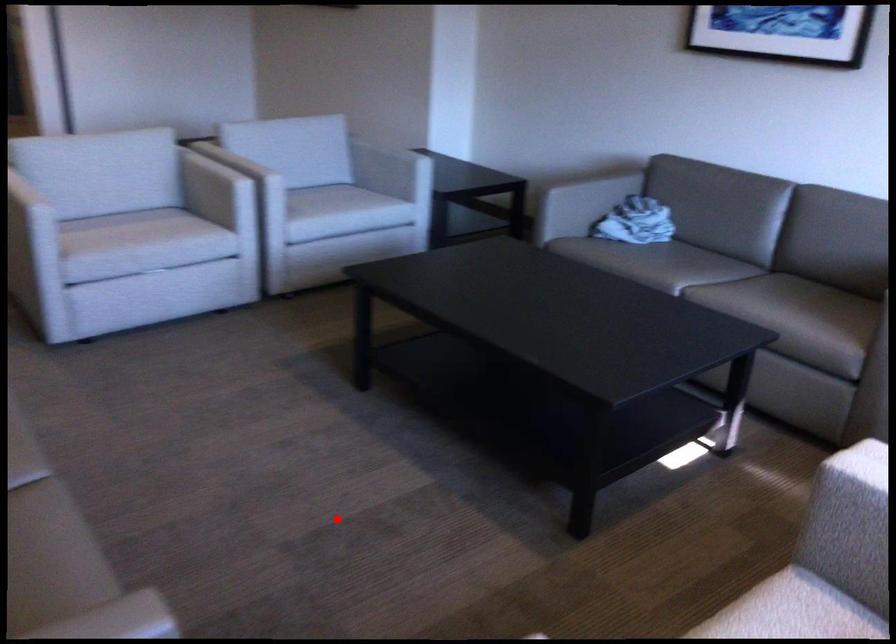
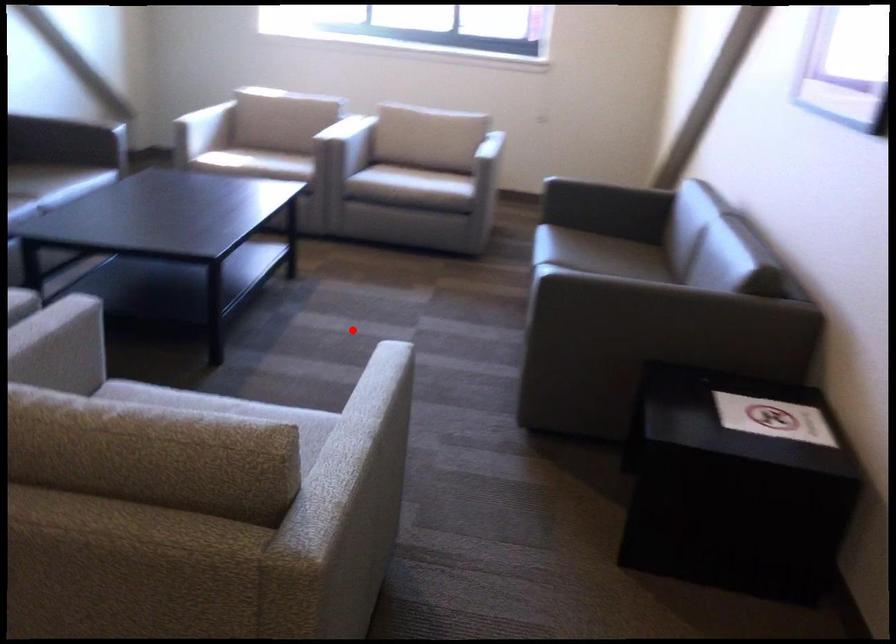
I am providing you with two images of the same scene from different viewpoints. A red point is marked on the first image and another point is marked on the second image. Do the highlighted points in image1 and image2 indicate the same real-world spot?

Yes